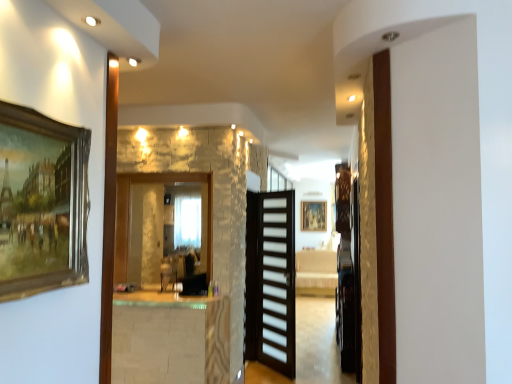
Question: Does white marble table at center contain clear glass mirror at center?

Choices:
 (A) yes
 (B) no

Answer: (B)

Question: Can you confirm if white marble table at center is positioned to the left of clear glass mirror at center?

Choices:
 (A) yes
 (B) no

Answer: (B)

Question: Is white marble table at center shorter than clear glass mirror at center?

Choices:
 (A) no
 (B) yes

Answer: (B)

Question: Is white marble table at center far from clear glass mirror at center?

Choices:
 (A) no
 (B) yes

Answer: (A)

Question: From the image's perspective, is white marble table at center located above clear glass mirror at center?

Choices:
 (A) yes
 (B) no

Answer: (B)

Question: In terms of height, does clear glass mirror at center look taller or shorter compared to black matte door at center?

Choices:
 (A) short
 (B) tall

Answer: (A)

Question: Looking at the image, does clear glass mirror at center seem bigger or smaller compared to black matte door at center?

Choices:
 (A) small
 (B) big

Answer: (B)

Question: Is point (209, 192) closer or farther from the camera than point (280, 316)?

Choices:
 (A) closer
 (B) farther

Answer: (A)

Question: Considering the positions of clear glass mirror at center and black matte door at center in the image, is clear glass mirror at center wider or thinner than black matte door at center?

Choices:
 (A) thin
 (B) wide

Answer: (B)

Question: Is clear glass mirror at center inside or outside of white marble table at center?

Choices:
 (A) outside
 (B) inside

Answer: (A)

Question: From their relative heights in the image, would you say clear glass mirror at center is taller or shorter than white marble table at center?

Choices:
 (A) tall
 (B) short

Answer: (A)

Question: From the image's perspective, is clear glass mirror at center located above or below white marble table at center?

Choices:
 (A) above
 (B) below

Answer: (A)

Question: Is clear glass mirror at center wider or thinner than white marble table at center?

Choices:
 (A) wide
 (B) thin

Answer: (B)

Question: In terms of size, does wooden picture frame at left appear bigger or smaller than black matte door at center?

Choices:
 (A) big
 (B) small

Answer: (B)

Question: From the image's perspective, is wooden picture frame at left located above or below black matte door at center?

Choices:
 (A) above
 (B) below

Answer: (A)